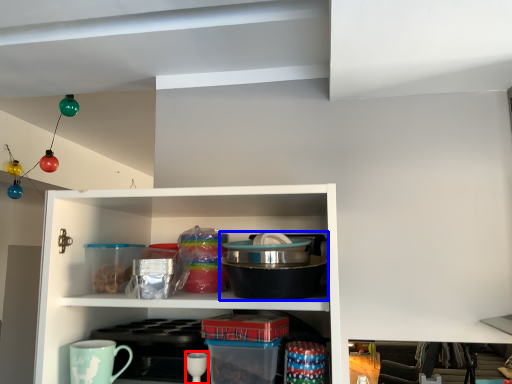
Question: Which point is further to the camera, tableware (highlighted by a red box) or appliance (highlighted by a blue box)?

Choices:
 (A) tableware
 (B) appliance

Answer: (A)